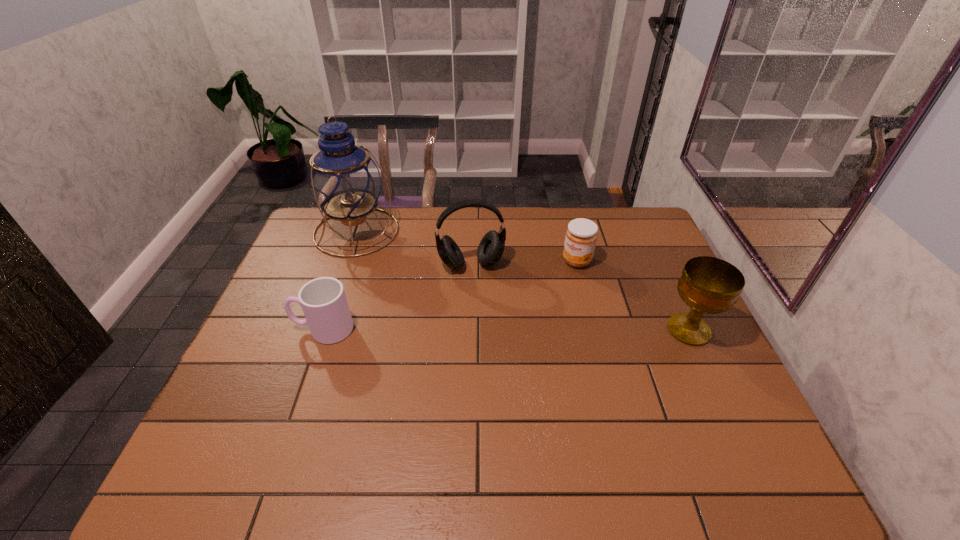
This screenshot has height=540, width=960. Identify the location of vacant position in the image that satisfies the following two spatial constraints: 1. on the back side of the third object from left to right; 2. on the right side of the fourth object from left to right. (471, 261).